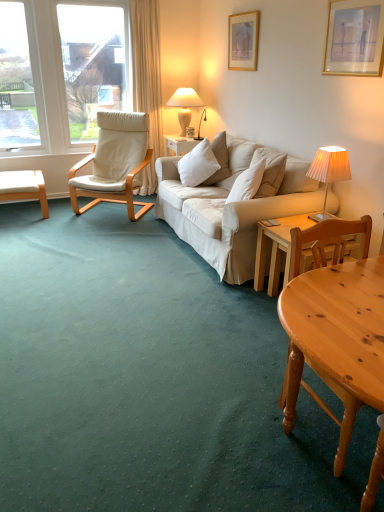
Find the location of a particular element. The image size is (384, 512). unoccupied region to the right of white leather chair at left, which is counted as the 1th desk, starting from the left is located at coordinates (72, 216).